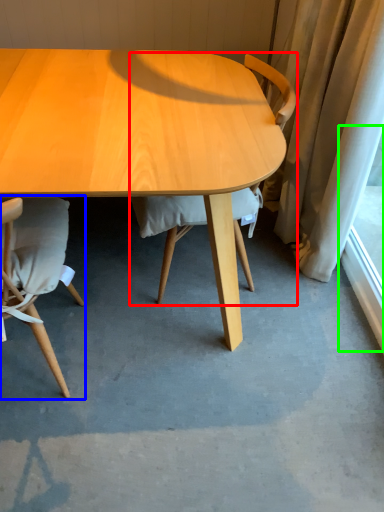
Question: Based on their relative distances, which object is farther from chair (highlighted by a red box)? Choose from chair (highlighted by a blue box) and window screen (highlighted by a green box).

Choices:
 (A) chair
 (B) window screen

Answer: (B)